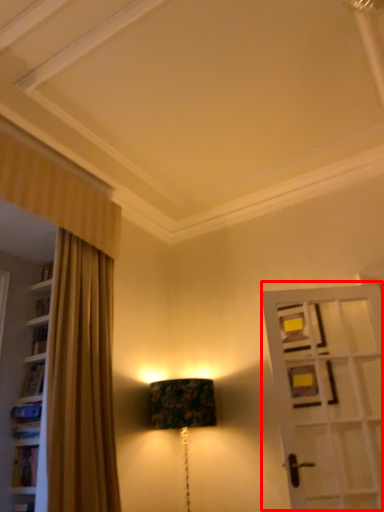
Question: From the image's perspective, where is door (annotated by the red box) located relative to table lamp?

Choices:
 (A) above
 (B) below

Answer: (A)